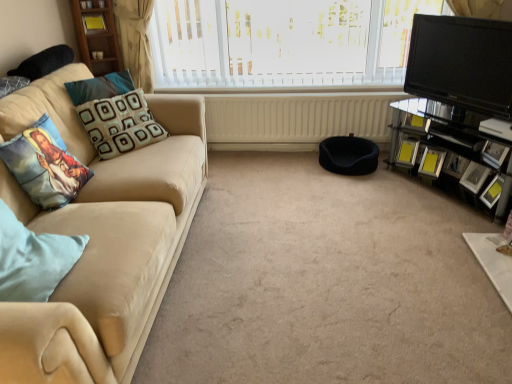
The width and height of the screenshot is (512, 384). In order to click on free point behind white glossy table at lower right in this screenshot , I will do `click(439, 223)`.